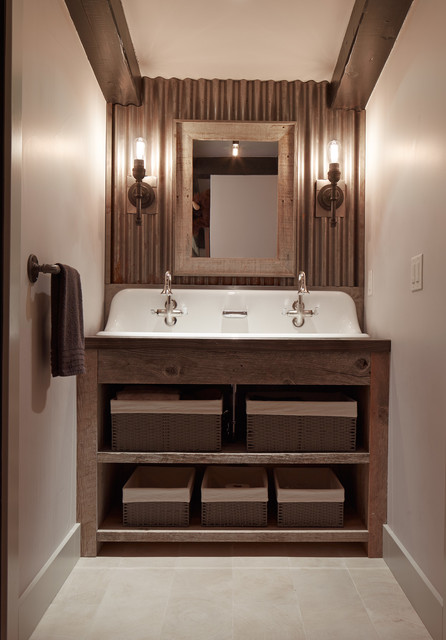
At what (x,y) coordinates should I click in order to perform the action: click on floor. Please return your answer as a coordinate pair (x, y). The width and height of the screenshot is (446, 640). Looking at the image, I should click on (250, 589).